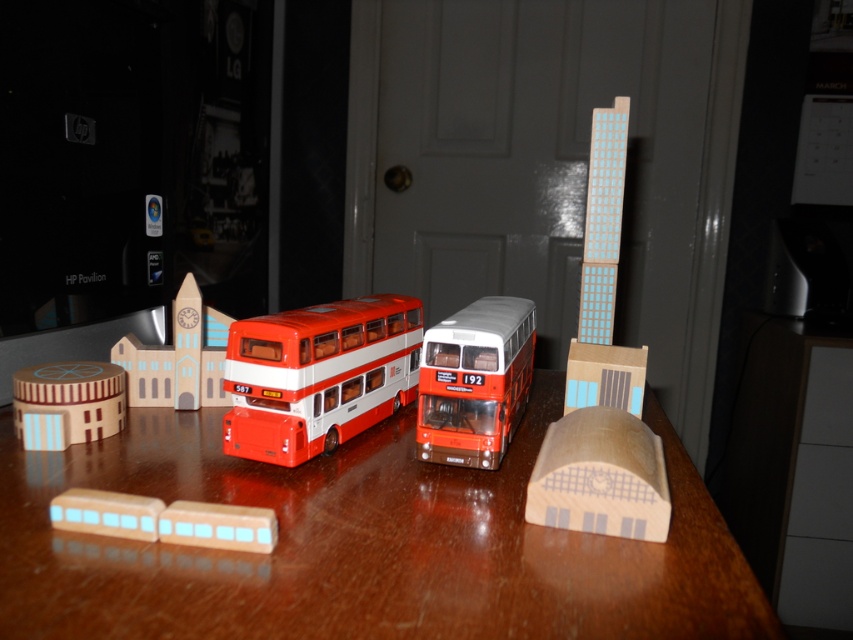
Is wooden train at lower left positioned behind wooden building at lower left?

No, it is not.

Does wooden train at lower left have a greater height compared to wooden building at lower left?

No, wooden train at lower left is not taller than wooden building at lower left.

Find the location of a particular element. wooden train at lower left is located at coordinates pos(165,518).

Is wooden train at lower left taller than wooden building at left?

No, wooden train at lower left is not taller than wooden building at left.

Which is behind, point (238, 525) or point (193, 317)?

The point (193, 317) is more distant.

Locate an element on the screen. wooden train at lower left is located at coordinates (165, 518).

Does matte red bus at center have a larger size compared to wooden building at left?

Yes, matte red bus at center is bigger than wooden building at left.

Can you confirm if matte red bus at center is shorter than wooden building at left?

Incorrect, matte red bus at center's height does not fall short of wooden building at left's.

Does point (457, 326) lie behind point (216, 397)?

That is False.

The image size is (853, 640). What are the coordinates of `matte red bus at center` in the screenshot? It's located at (474, 381).